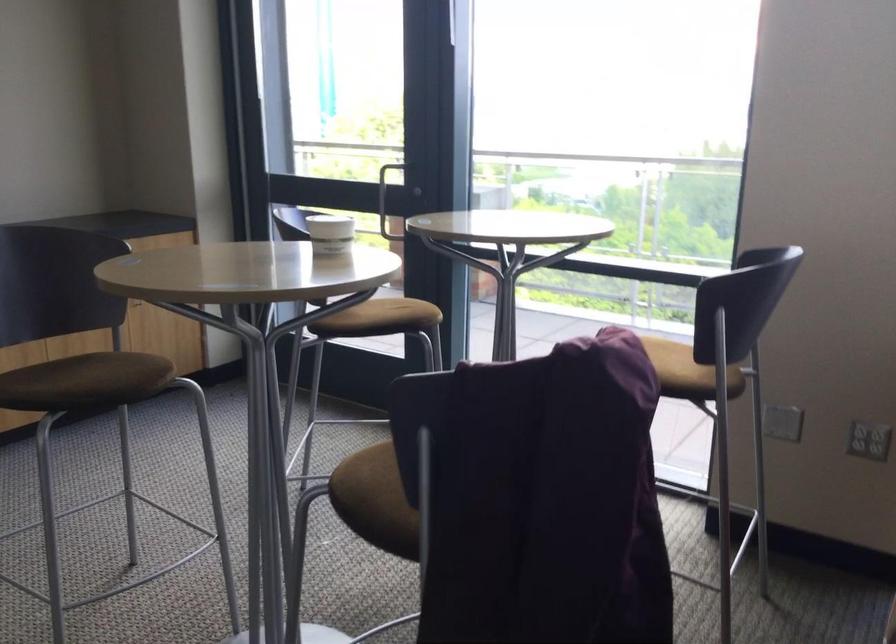
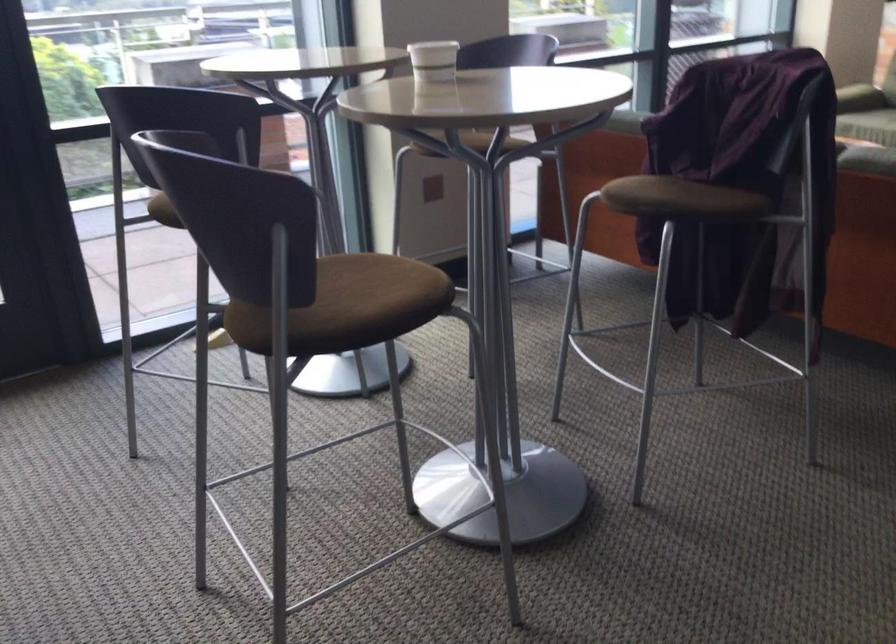
Where in the second image is the point corresponding to (99,371) from the first image?

(371, 292)